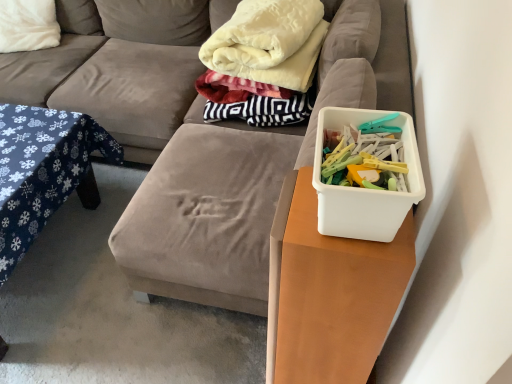
Question: Can you confirm if white soft pillow at upper left is bigger than blue fabric table at left?

Choices:
 (A) no
 (B) yes

Answer: (A)

Question: Can blue fabric table at left be found inside white soft pillow at upper left?

Choices:
 (A) yes
 (B) no

Answer: (B)

Question: Does white soft pillow at upper left turn towards blue fabric table at left?

Choices:
 (A) no
 (B) yes

Answer: (B)

Question: Considering the relative sizes of white soft pillow at upper left and blue fabric table at left in the image provided, is white soft pillow at upper left thinner than blue fabric table at left?

Choices:
 (A) yes
 (B) no

Answer: (A)

Question: Is white soft pillow at upper left at the right side of blue fabric table at left?

Choices:
 (A) no
 (B) yes

Answer: (A)

Question: Does white soft pillow at upper left have a lesser height compared to blue fabric table at left?

Choices:
 (A) no
 (B) yes

Answer: (A)

Question: Is blue fabric table at left far from velvet fabric couch at center?

Choices:
 (A) no
 (B) yes

Answer: (A)

Question: Is blue fabric table at left directly adjacent to velvet fabric couch at center?

Choices:
 (A) no
 (B) yes

Answer: (A)

Question: Does blue fabric table at left have a lesser height compared to velvet fabric couch at center?

Choices:
 (A) no
 (B) yes

Answer: (B)

Question: Is velvet fabric couch at center surrounded by blue fabric table at left?

Choices:
 (A) yes
 (B) no

Answer: (B)

Question: Is blue fabric table at left thinner than velvet fabric couch at center?

Choices:
 (A) yes
 (B) no

Answer: (A)

Question: Is blue fabric table at left wider than velvet fabric couch at center?

Choices:
 (A) yes
 (B) no

Answer: (B)

Question: From the image's perspective, would you say white plastic container at right is positioned over white soft pillow at upper left?

Choices:
 (A) no
 (B) yes

Answer: (A)